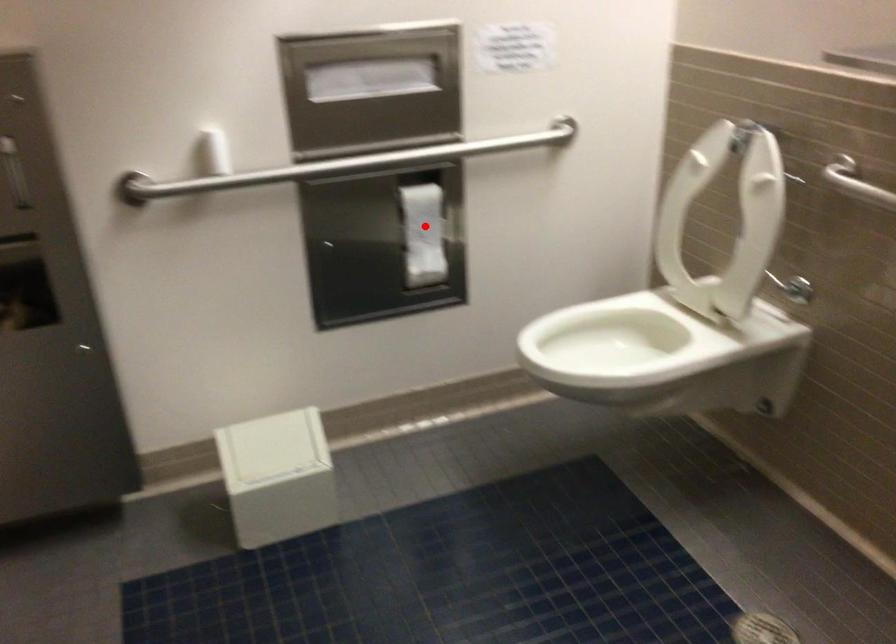
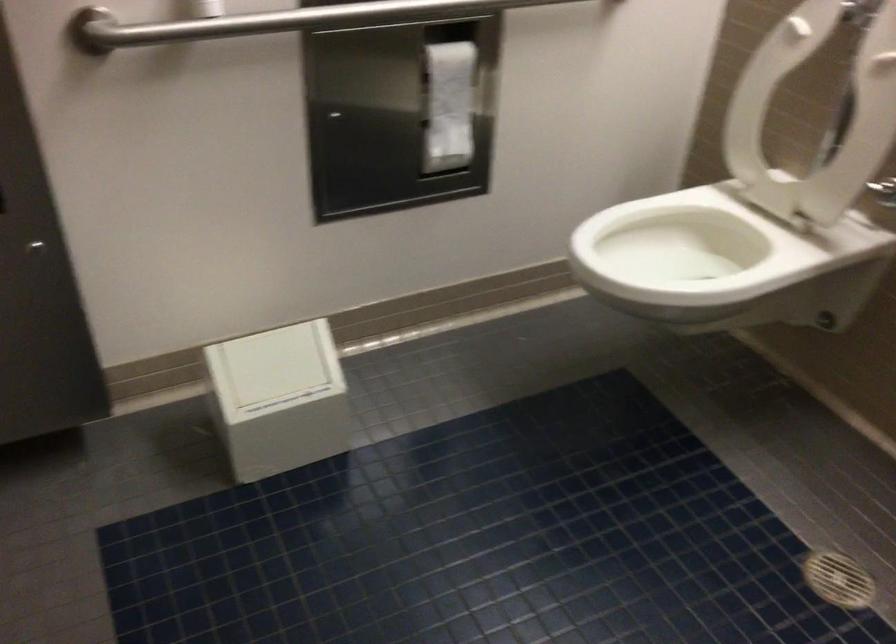
Locate, in the second image, the point that corresponds to the highlighted location in the first image.

(450, 98)